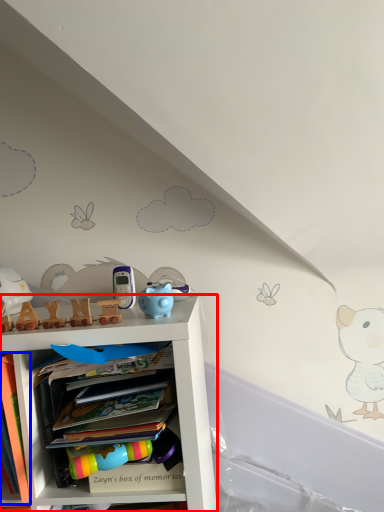
Question: Which of the following is the closest to the observer, shelf (highlighted by a red box) or book (highlighted by a blue box)?

Choices:
 (A) shelf
 (B) book

Answer: (B)